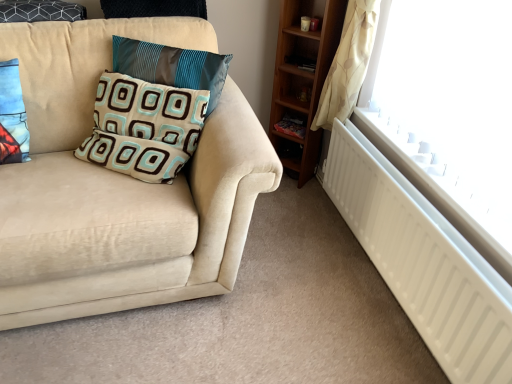
Question: Can you confirm if teal satin pillow at upper left, the 3th pillow from the left, is smaller than blue fabric pillow at left, acting as the third pillow starting from the right?

Choices:
 (A) no
 (B) yes

Answer: (A)

Question: Could you tell me if teal satin pillow at upper left, the 3th pillow from the left, is turned towards blue fabric pillow at left, the 1th pillow when ordered from left to right?

Choices:
 (A) no
 (B) yes

Answer: (A)

Question: From the image's perspective, is teal satin pillow at upper left, arranged as the first pillow when viewed from the right, on blue fabric pillow at left, the 1th pillow when ordered from left to right?

Choices:
 (A) yes
 (B) no

Answer: (A)

Question: Does teal satin pillow at upper left, the 3th pillow from the left, appear on the right side of blue fabric pillow at left, the 1th pillow when ordered from left to right?

Choices:
 (A) yes
 (B) no

Answer: (A)

Question: Is teal satin pillow at upper left, arranged as the first pillow when viewed from the right, positioned far away from blue fabric pillow at left, acting as the third pillow starting from the right?

Choices:
 (A) yes
 (B) no

Answer: (B)

Question: Is teal satin pillow at upper left, the 3th pillow from the left, bigger than blue fabric pillow at left, the 1th pillow when ordered from left to right?

Choices:
 (A) yes
 (B) no

Answer: (A)

Question: Is the position of teal satin pillow at upper left, arranged as the first pillow when viewed from the right, more distant than that of patterned fabric pillow at center, marked as the second pillow in a left-to-right arrangement?

Choices:
 (A) no
 (B) yes

Answer: (B)

Question: Does teal satin pillow at upper left, arranged as the first pillow when viewed from the right, have a larger size compared to patterned fabric pillow at center, acting as the 2th pillow starting from the right?

Choices:
 (A) no
 (B) yes

Answer: (A)

Question: Considering the relative positions of teal satin pillow at upper left, arranged as the first pillow when viewed from the right, and patterned fabric pillow at center, acting as the 2th pillow starting from the right, in the image provided, is teal satin pillow at upper left, arranged as the first pillow when viewed from the right, to the right of patterned fabric pillow at center, acting as the 2th pillow starting from the right, from the viewer's perspective?

Choices:
 (A) no
 (B) yes

Answer: (B)

Question: From a real-world perspective, is teal satin pillow at upper left, the 3th pillow from the left, on top of patterned fabric pillow at center, acting as the 2th pillow starting from the right?

Choices:
 (A) no
 (B) yes

Answer: (B)

Question: Can you confirm if teal satin pillow at upper left, arranged as the first pillow when viewed from the right, is shorter than patterned fabric pillow at center, acting as the 2th pillow starting from the right?

Choices:
 (A) no
 (B) yes

Answer: (A)

Question: Considering the relative sizes of teal satin pillow at upper left, the 3th pillow from the left, and patterned fabric pillow at center, marked as the second pillow in a left-to-right arrangement, in the image provided, is teal satin pillow at upper left, the 3th pillow from the left, smaller than patterned fabric pillow at center, marked as the second pillow in a left-to-right arrangement,?

Choices:
 (A) no
 (B) yes

Answer: (B)

Question: Could you tell me if teal satin pillow at upper left, the 3th pillow from the left, is facing wooden shelf at lower right?

Choices:
 (A) yes
 (B) no

Answer: (B)